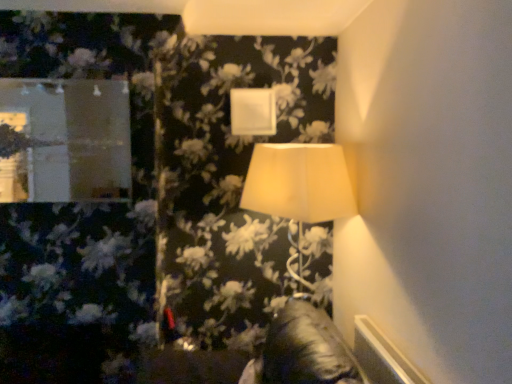
This screenshot has height=384, width=512. What do you see at coordinates (67, 140) in the screenshot? I see `matte glass mirror at upper left` at bounding box center [67, 140].

You are a GUI agent. You are given a task and a screenshot of the screen. Output one action in this format:
    pyautogui.click(x=<x>, y=<y>)
    Task: Click on the matte glass mirror at upper left
    This screenshot has width=512, height=384.
    Given the screenshot: What is the action you would take?
    point(67,140)

What is the approximate height of matte glass mirror at upper left?

matte glass mirror at upper left is 25.13 inches tall.

This screenshot has height=384, width=512. Find the location of `matte white lampshade at center`. matte white lampshade at center is located at coordinates (298, 183).

Image resolution: width=512 pixels, height=384 pixels. Describe the element at coordinates (298, 183) in the screenshot. I see `matte white lampshade at center` at that location.

Identify the location of matte glass mirror at upper left. (67, 140).

Which is more to the right, matte glass mirror at upper left or matte white lampshade at center?

matte white lampshade at center.

In the image, is matte glass mirror at upper left positioned in front of or behind matte white lampshade at center?

Visually, matte glass mirror at upper left is located behind matte white lampshade at center.

Does point (93, 187) come closer to viewer compared to point (337, 200)?

No, it is behind (337, 200).

From the image's perspective, is matte glass mirror at upper left located beneath matte white lampshade at center?

No, from the image's perspective, matte glass mirror at upper left is not beneath matte white lampshade at center.

From a real-world perspective, which object stands above the other?

matte glass mirror at upper left is physically above.

Considering the sizes of objects matte glass mirror at upper left and matte white lampshade at center in the image provided, who is thinner, matte glass mirror at upper left or matte white lampshade at center?

Thinner between the two is matte glass mirror at upper left.

Is matte glass mirror at upper left shorter than matte white lampshade at center?

Indeed, matte glass mirror at upper left has a lesser height compared to matte white lampshade at center.

Between matte glass mirror at upper left and matte white lampshade at center, which one has larger size?

matte white lampshade at center.

Consider the image. Is matte glass mirror at upper left not inside matte white lampshade at center?

Yes, matte glass mirror at upper left is located beyond the bounds of matte white lampshade at center.

Is matte glass mirror at upper left placed right next to matte white lampshade at center?

No, matte glass mirror at upper left is not next to matte white lampshade at center.

Could you tell me if matte glass mirror at upper left is turned towards matte white lampshade at center?

No, matte glass mirror at upper left is not oriented towards matte white lampshade at center.

Can you tell me how much matte glass mirror at upper left and matte white lampshade at center differ in facing direction?

The facing directions of matte glass mirror at upper left and matte white lampshade at center are 4.12 degrees apart.

Find the location of a particular element. Image resolution: width=512 pixels, height=384 pixels. lamp below the matte glass mirror at upper left (from a real-world perspective) is located at coordinates (298, 183).

Can you confirm if matte white lampshade at center is positioned to the left of matte glass mirror at upper left?

In fact, matte white lampshade at center is to the right of matte glass mirror at upper left.

Is matte white lampshade at center in front of or behind matte glass mirror at upper left in the image?

Clearly, matte white lampshade at center is in front of matte glass mirror at upper left.

Does point (285, 172) come closer to viewer compared to point (33, 164)?

Yes, it is.

In the scene shown: From the image's perspective, between matte white lampshade at center and matte glass mirror at upper left, who is located below?

matte white lampshade at center is shown below in the image.

From a real-world perspective, is matte white lampshade at center on matte glass mirror at upper left?

Incorrect, from a real-world perspective, matte white lampshade at center is lower than matte glass mirror at upper left.

Considering the relative sizes of matte white lampshade at center and matte glass mirror at upper left in the image provided, is matte white lampshade at center thinner than matte glass mirror at upper left?

No, matte white lampshade at center is not thinner than matte glass mirror at upper left.

Between matte white lampshade at center and matte glass mirror at upper left, which one has more height?

matte white lampshade at center.

Who is smaller, matte white lampshade at center or matte glass mirror at upper left?

matte glass mirror at upper left.

Can we say matte white lampshade at center lies outside matte glass mirror at upper left?

Yes.

Is matte white lampshade at center far away from matte glass mirror at upper left?

Actually, matte white lampshade at center and matte glass mirror at upper left are a little close together.

Is matte white lampshade at center oriented away from matte glass mirror at upper left?

No, matte white lampshade at center is not facing the opposite direction of matte glass mirror at upper left.

Locate an element on the screen. lamp located below the matte glass mirror at upper left (from the image's perspective) is located at coordinates (298, 183).

What are the coordinates of `lamp below the matte glass mirror at upper left (from the image's perspective)` in the screenshot? It's located at (298, 183).

This screenshot has height=384, width=512. I want to click on mirror behind the matte white lampshade at center, so click(67, 140).